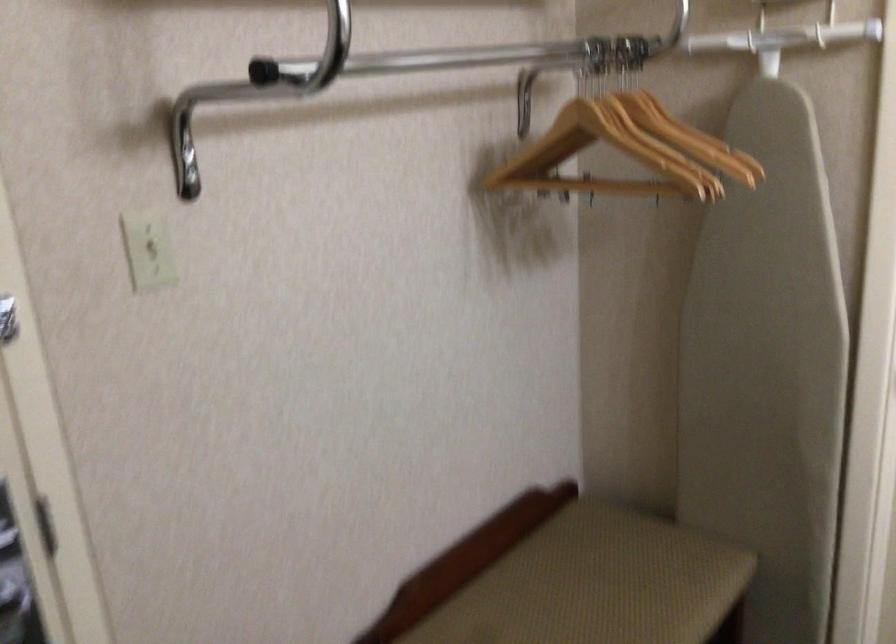
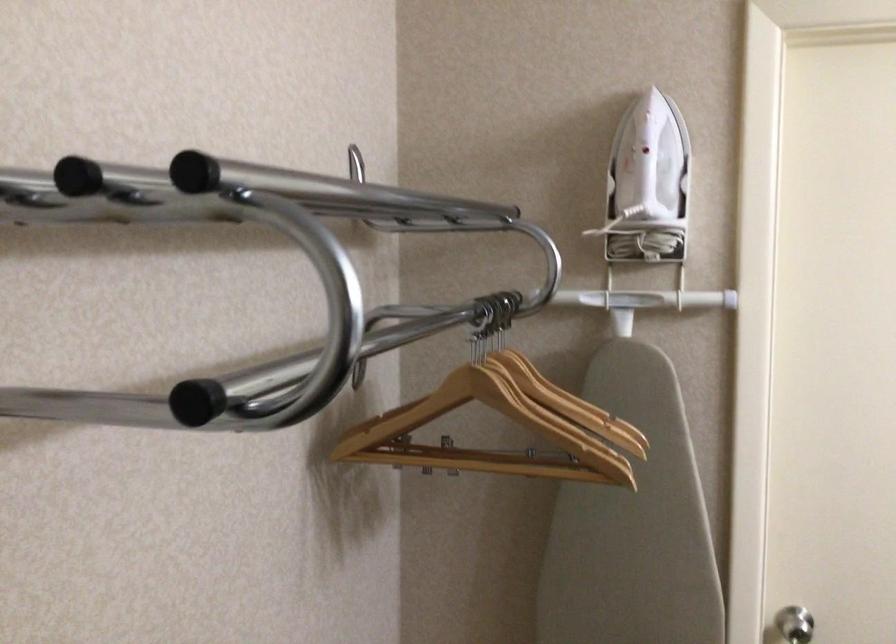
Which direction would the cameraman need to move to produce the second image?

The cameraman moved toward left, forward.